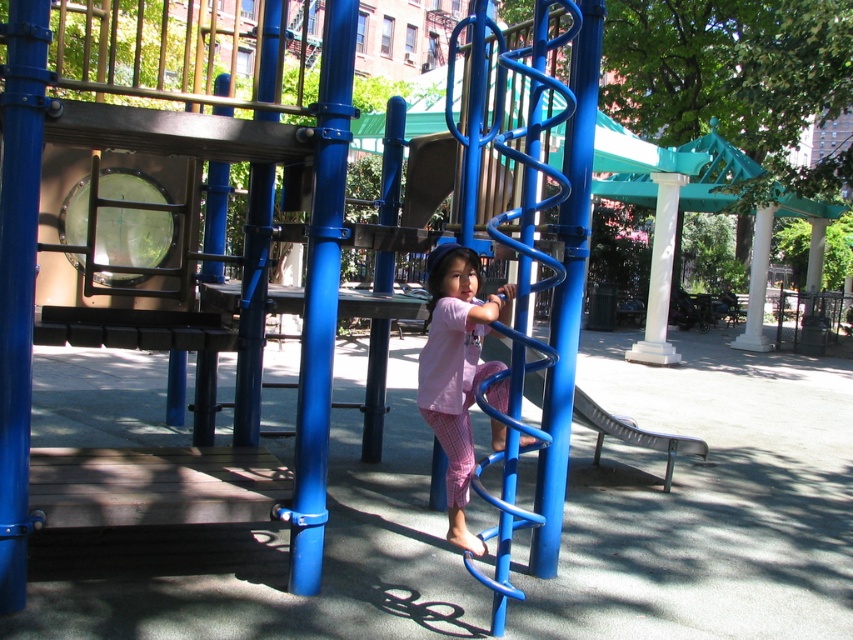
Question: Is pink cotton pants at center above metallic blue slide at center?

Choices:
 (A) no
 (B) yes

Answer: (B)

Question: Can you confirm if pink cotton pants at center is positioned above metallic blue slide at center?

Choices:
 (A) no
 (B) yes

Answer: (B)

Question: Among these objects, which one is nearest to the camera?

Choices:
 (A) metallic blue slide at center
 (B) pink cotton pants at center

Answer: (B)

Question: Can you confirm if pink cotton pants at center is thinner than metallic blue slide at center?

Choices:
 (A) yes
 (B) no

Answer: (A)